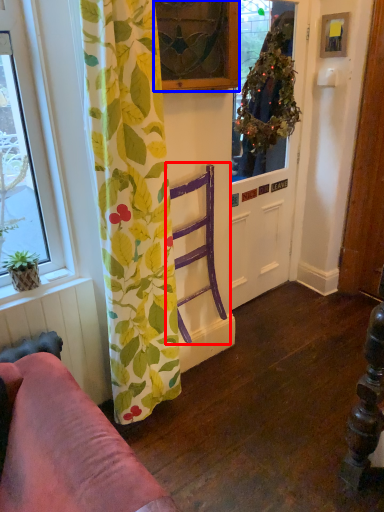
Question: Which of the following is the closest to the observer, armchair (highlighted by a red box) or window (highlighted by a blue box)?

Choices:
 (A) armchair
 (B) window

Answer: (B)